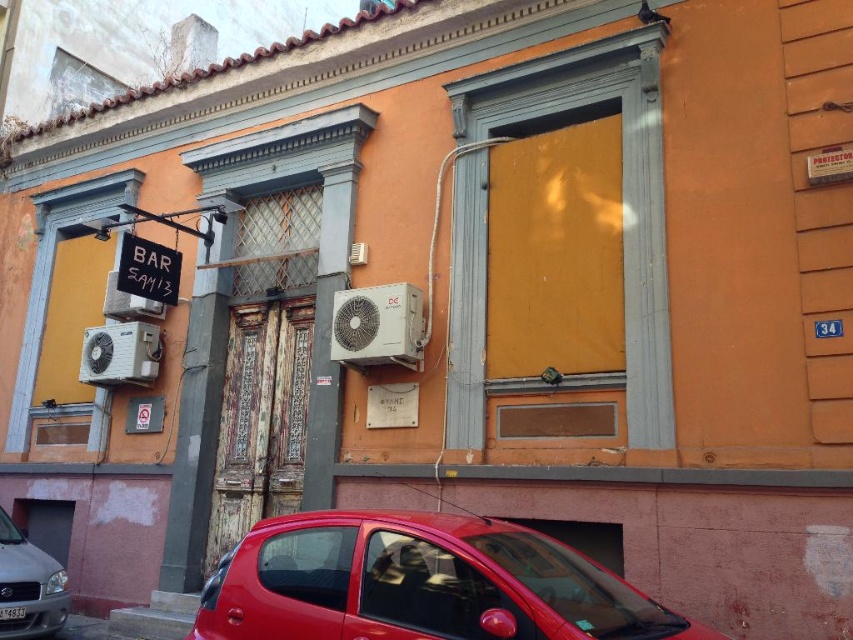
You are a delivery person trying to install a new air conditioner unit that is 1 meter wide. You have two options on the building facade shown in the image. Which air conditioner unit, the white metallic air conditioner at center or the white metallic air conditioner at lower left, has enough space for the new unit?

The white metallic air conditioner at lower left is wider than the white metallic air conditioner at center. Since the new unit is 1 meter wide, you should check the width of the lower left unit to see if it can accommodate the new air conditioner.

You are a delivery person trying to install a new air conditioner unit on the building wall. You need to place it between the white metallic air conditioner at center and the white metallic air conditioner at lower left. Is there enough space between them to install the new unit?

The white metallic air conditioner at center is positioned over the white metallic air conditioner at lower left, meaning they are stacked vertically. Installing a new unit between them would require horizontal space, which isn not available since they are vertically aligned. Therefore, there is no space to install the new unit between them.

You are a delivery person who needs to place a new air conditioner unit that is 1.2 meters tall. You see the white metallic air conditioner at center and the white metallic air conditioner at lower left. Which one can accommodate the new unit without exceeding its height?

The white metallic air conditioner at center is taller than the white metallic air conditioner at lower left, so the new unit can be placed at the white metallic air conditioner at center since it has sufficient height.